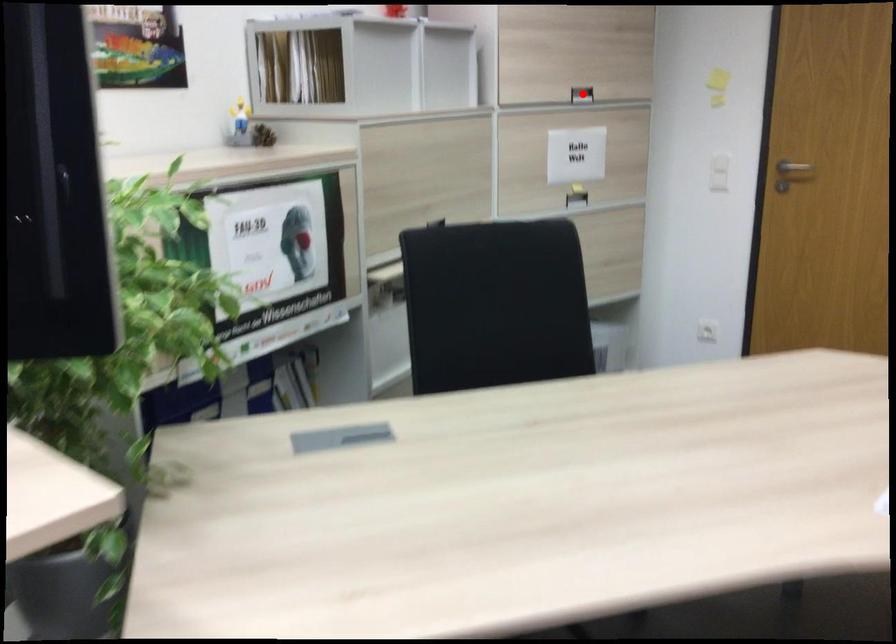
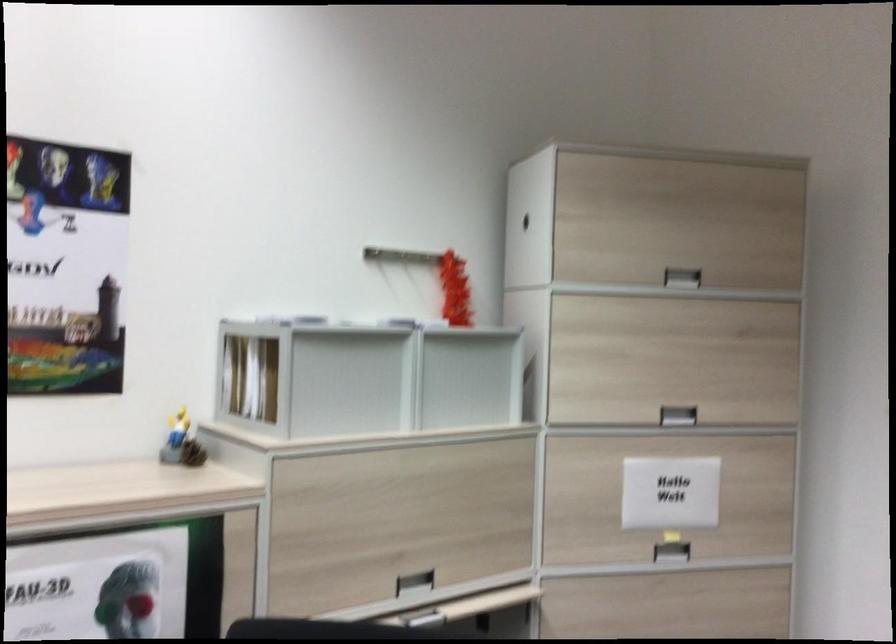
Question: A red point is marked in image1. In image2, is the corresponding 3D point closer to the camera or farther? Reply with the corresponding letter.

Choices:
 (A) The corresponding 3D point is closer.
 (B) The corresponding 3D point is farther.

Answer: (A)